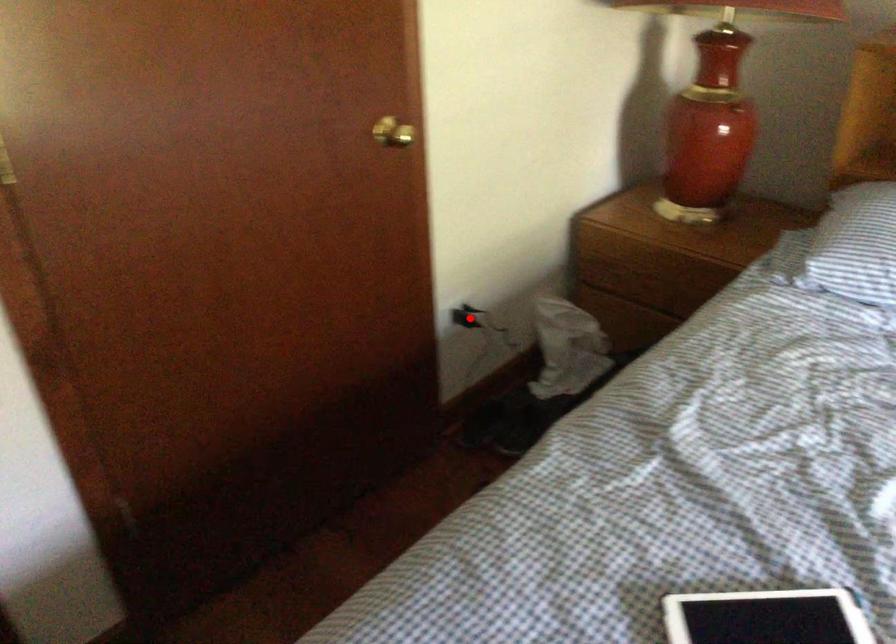
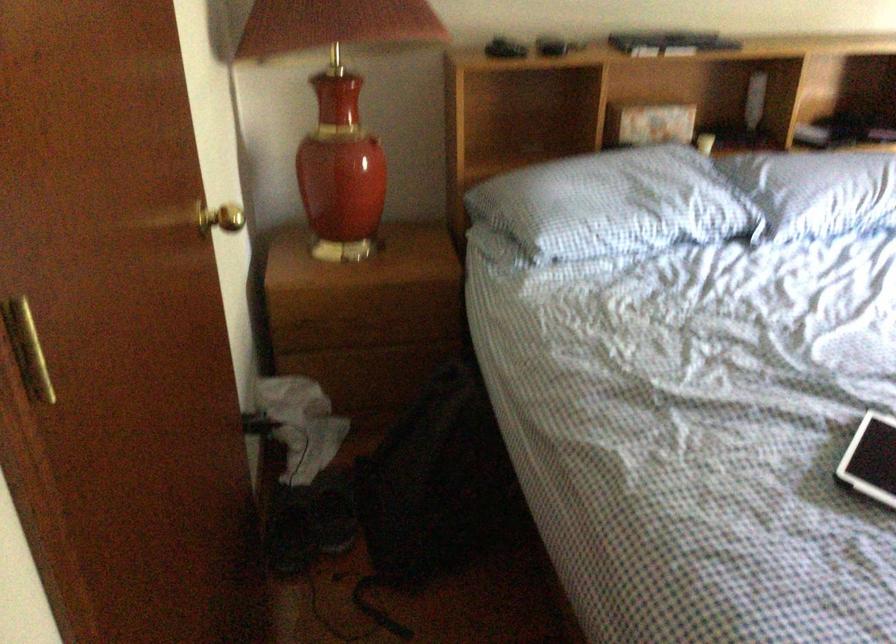
Question: I am providing you with two images of the same scene from different viewpoints. A red point is marked on the first image. Is the red point's position out of view in image 2?

Choices:
 (A) Yes
 (B) No

Answer: (A)